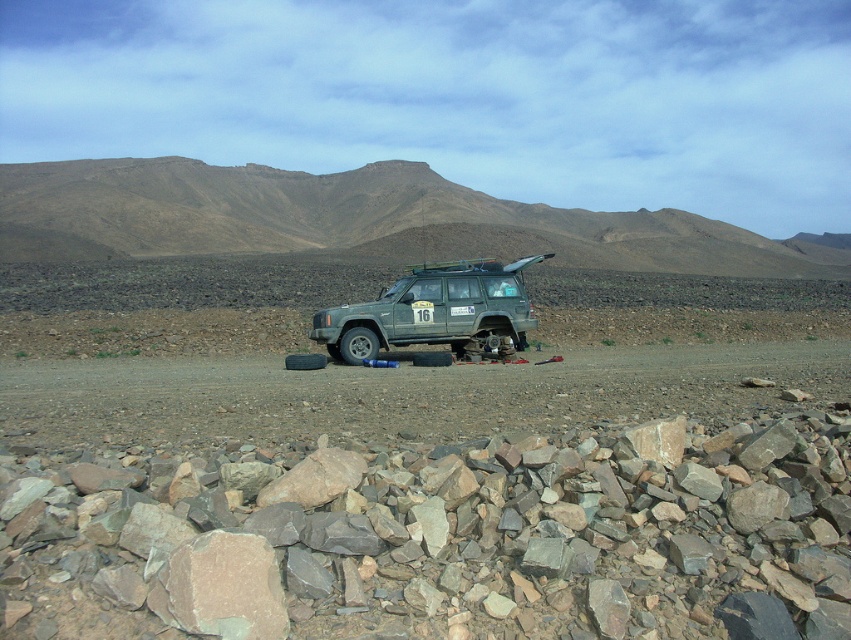
Question: Does rusty stone pile at center have a smaller size compared to green matte jeep at center?

Choices:
 (A) no
 (B) yes

Answer: (B)

Question: Which object is closer to the camera taking this photo?

Choices:
 (A) green matte jeep at center
 (B) brown rocky mountain at upper center
 (C) rusty stone pile at center

Answer: (C)

Question: Does brown rocky mountain at upper center appear on the right side of green matte jeep at center?

Choices:
 (A) yes
 (B) no

Answer: (A)

Question: Which point is closer to the camera?

Choices:
 (A) green matte jeep at center
 (B) rusty stone pile at center
 (C) brown rocky mountain at upper center

Answer: (B)

Question: Which of these objects is positioned farthest from the green matte jeep at center?

Choices:
 (A) brown rocky mountain at upper center
 (B) rusty stone pile at center

Answer: (A)

Question: Is the position of brown rocky mountain at upper center more distant than that of green matte jeep at center?

Choices:
 (A) yes
 (B) no

Answer: (A)